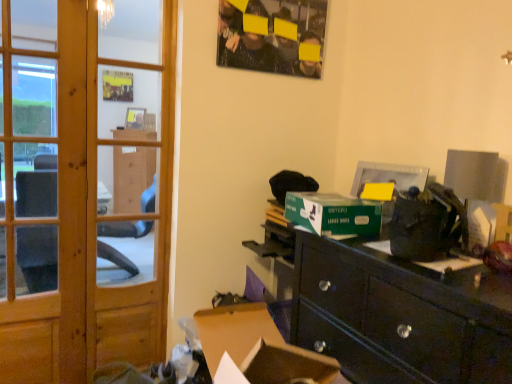
Question: From the image's perspective, is green cardboard box at center above wooden door at left?

Choices:
 (A) yes
 (B) no

Answer: (B)

Question: Would you say green cardboard box at center is a long distance from wooden door at left?

Choices:
 (A) no
 (B) yes

Answer: (A)

Question: Is green cardboard box at center to the left of wooden door at left from the viewer's perspective?

Choices:
 (A) yes
 (B) no

Answer: (B)

Question: Is green cardboard box at center smaller than wooden door at left?

Choices:
 (A) yes
 (B) no

Answer: (A)

Question: Does green cardboard box at center appear on the right side of wooden door at left?

Choices:
 (A) no
 (B) yes

Answer: (B)

Question: From the image's perspective, is green cardboard box at center located above or below wooden screen door at left?

Choices:
 (A) above
 (B) below

Answer: (B)

Question: From a real-world perspective, is green cardboard box at center positioned above or below wooden screen door at left?

Choices:
 (A) above
 (B) below

Answer: (A)

Question: In terms of height, does green cardboard box at center look taller or shorter compared to wooden screen door at left?

Choices:
 (A) short
 (B) tall

Answer: (A)

Question: Is green cardboard box at center in front of or behind wooden screen door at left in the image?

Choices:
 (A) front
 (B) behind

Answer: (A)

Question: From the image's perspective, is matte black poster at upper center located above or below wooden door at left?

Choices:
 (A) below
 (B) above

Answer: (B)

Question: From a real-world perspective, is matte black poster at upper center positioned above or below wooden door at left?

Choices:
 (A) below
 (B) above

Answer: (B)

Question: Is point (224, 4) closer or farther from the camera than point (87, 135)?

Choices:
 (A) closer
 (B) farther

Answer: (B)

Question: Looking at their shapes, would you say matte black poster at upper center is wider or thinner than wooden door at left?

Choices:
 (A) wide
 (B) thin

Answer: (B)

Question: Based on their positions, is brown cardboard box at lower center located to the left or right of matte black poster at upper center?

Choices:
 (A) left
 (B) right

Answer: (A)

Question: Is brown cardboard box at lower center in front of or behind matte black poster at upper center in the image?

Choices:
 (A) front
 (B) behind

Answer: (A)